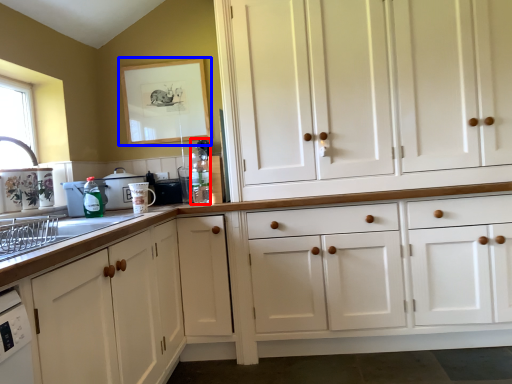
Question: Which point is closer to the camera, bottle (highlighted by a red box) or picture frame (highlighted by a blue box)?

Choices:
 (A) bottle
 (B) picture frame

Answer: (A)